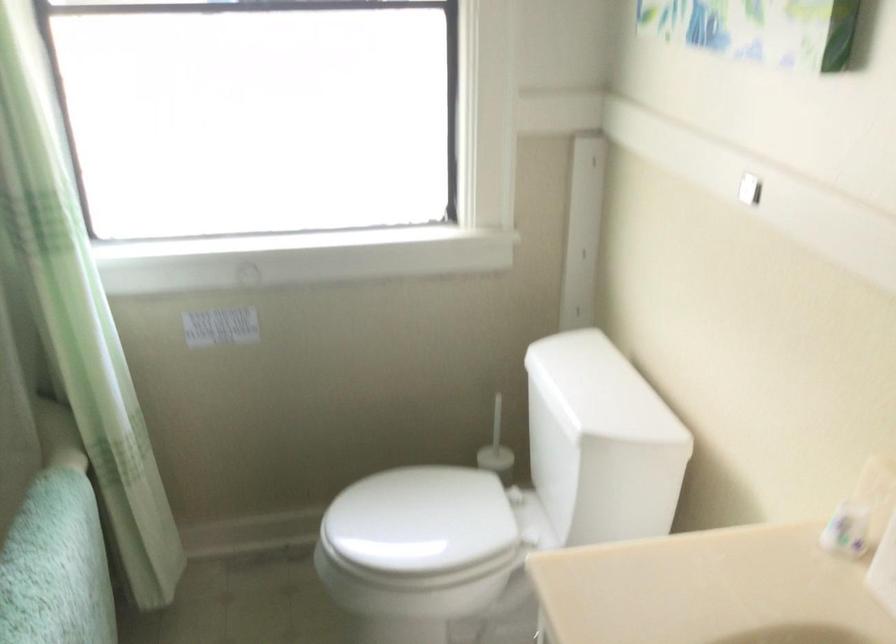
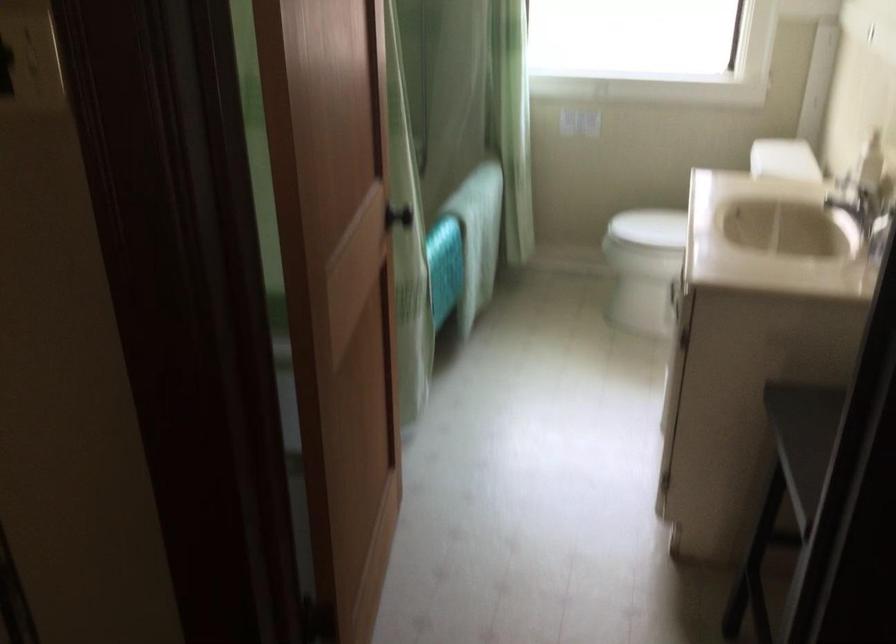
Which direction would the cameraman need to move to produce the second image?

The cameraman walked toward right, backward.